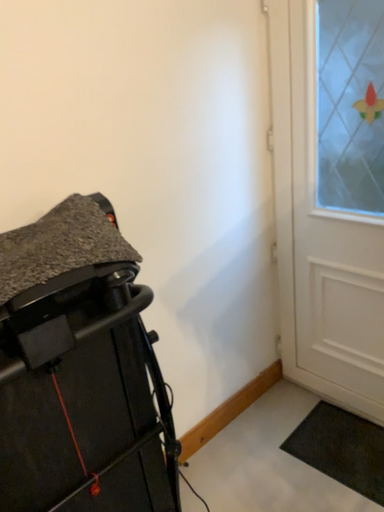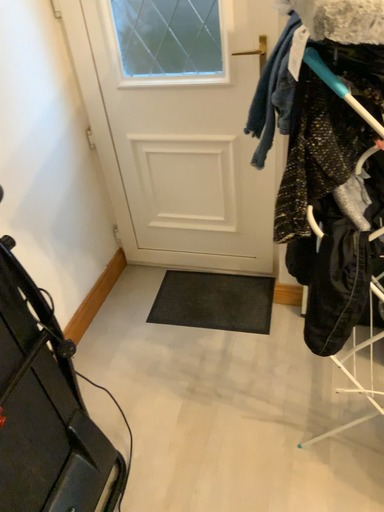
Question: Which way did the camera rotate in the video?

Choices:
 (A) rotated left
 (B) rotated right

Answer: (B)